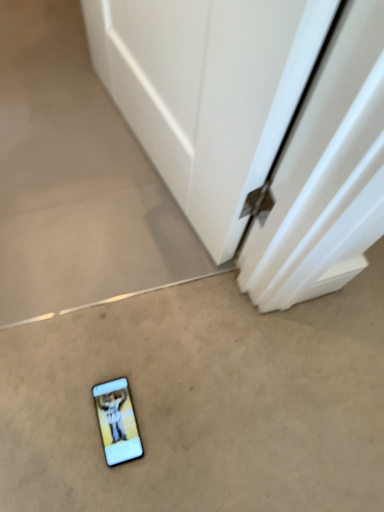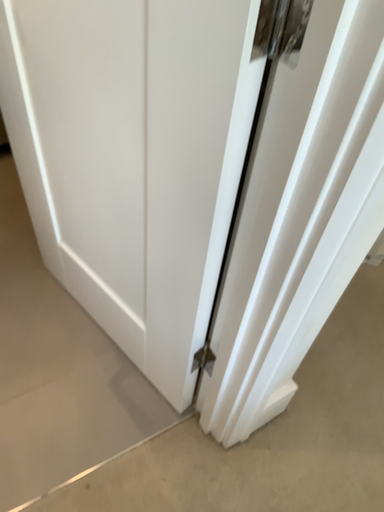
Question: Which way did the camera rotate in the video?

Choices:
 (A) rotated right
 (B) rotated left

Answer: (A)